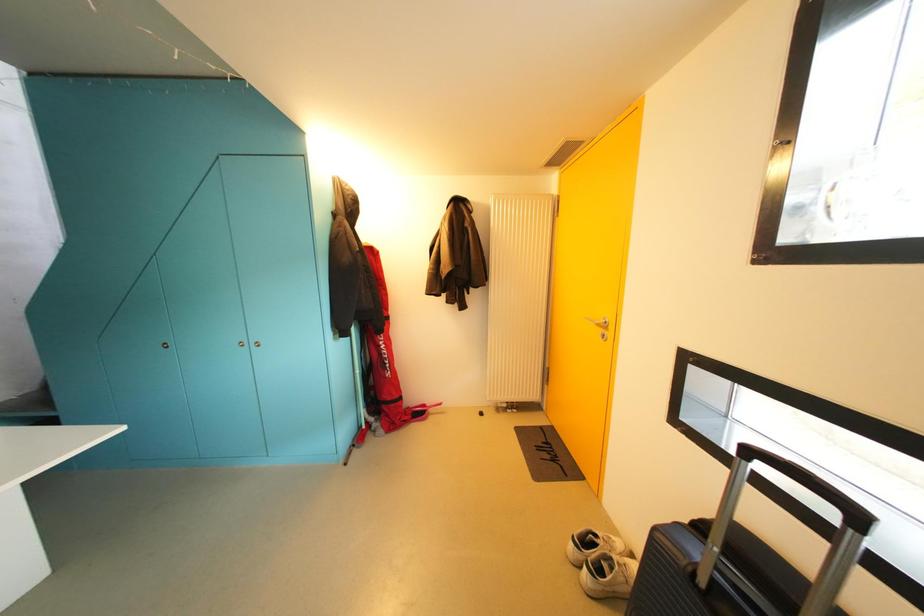
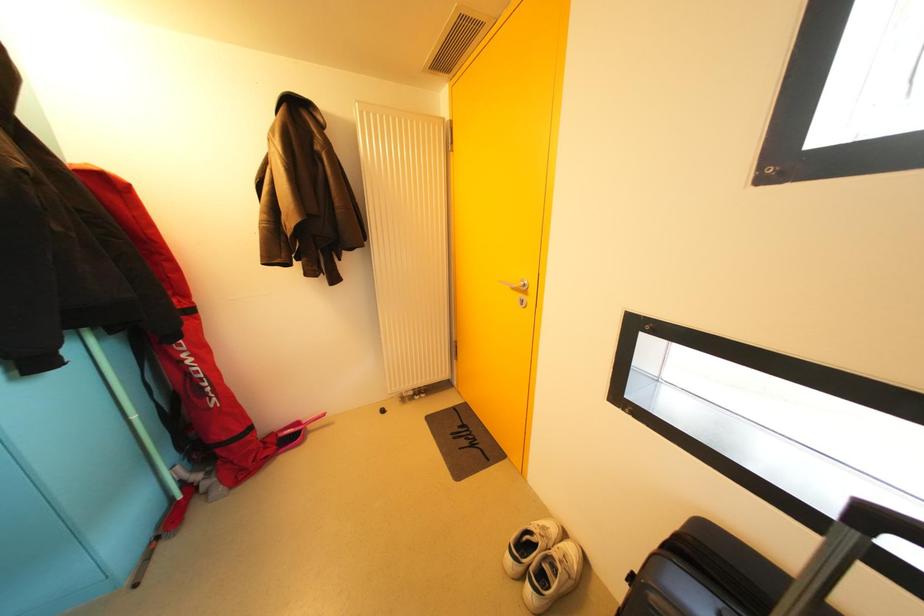
Question: Which direction would the cameraman need to move to produce the second image? Reply with the corresponding letter.

Choices:
 (A) Left
 (B) Right
 (C) Forward
 (D) Backward

Answer: (C)